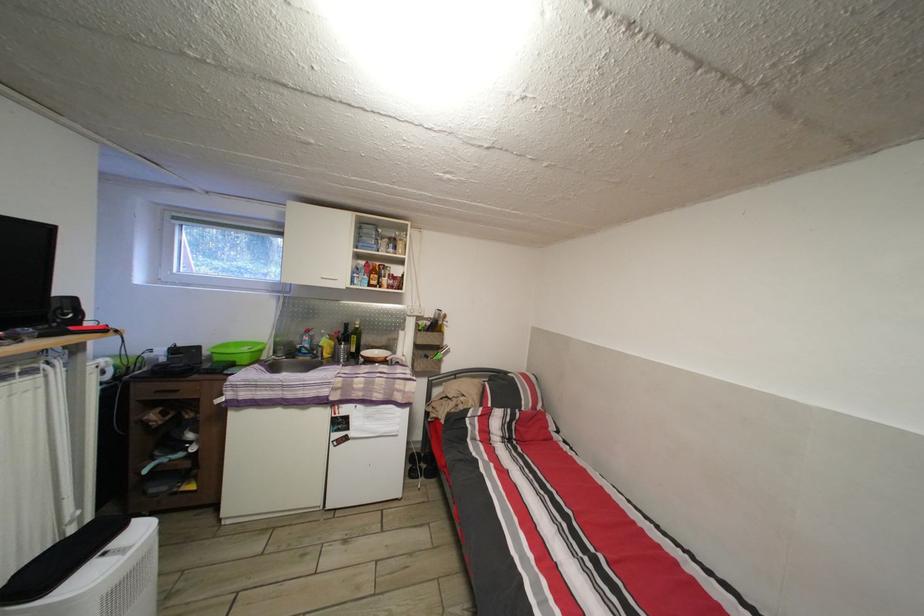
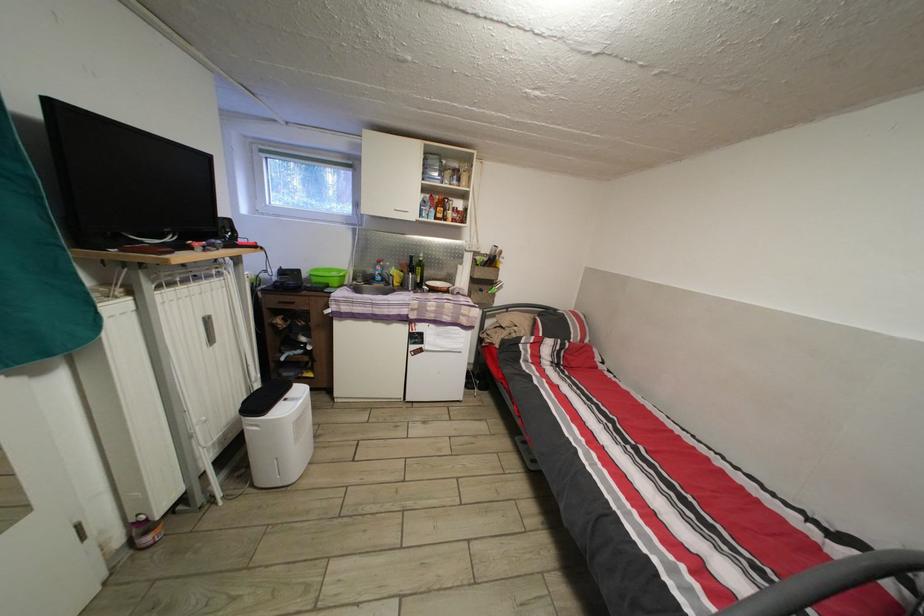
Where in the second image is the point corresponding to the point at 354,331 from the first image?

(419, 265)